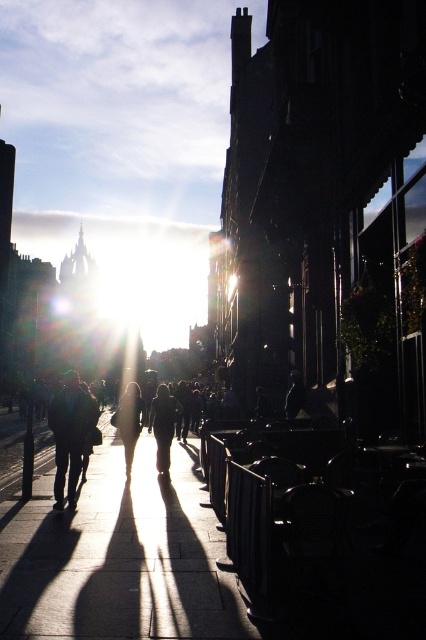
Does dark clothing figure at center have a larger size compared to matte black person at center?

Yes.

From the picture: Is dark clothing figure at center to the left of matte black person at center from the viewer's perspective?

In fact, dark clothing figure at center is to the right of matte black person at center.

Find the location of `dark clothing figure at center`. dark clothing figure at center is located at coordinates (164, 426).

The image size is (426, 640). I want to click on smooth concrete sidewalk at center, so click(x=118, y=556).

Who is more distant from viewer, [180,536] or [66,372]?

The point [66,372] is behind.

What do you see at coordinates (118, 556) in the screenshot?
I see `smooth concrete sidewalk at center` at bounding box center [118, 556].

The image size is (426, 640). Identify the location of smooth concrete sidewalk at center. (118, 556).

Is point (31, 516) closer to viewer compared to point (126, 387)?

Yes, it is in front of point (126, 387).

Does smooth concrete sidewalk at center have a greater width compared to matte black person at center?

Yes, smooth concrete sidewalk at center is wider than matte black person at center.

Between point (108, 435) and point (111, 420), which one is positioned in front?

Positioned in front is point (111, 420).

This screenshot has height=640, width=426. Find the location of `smooth concrete sidewalk at center`. smooth concrete sidewalk at center is located at coordinates (118, 556).